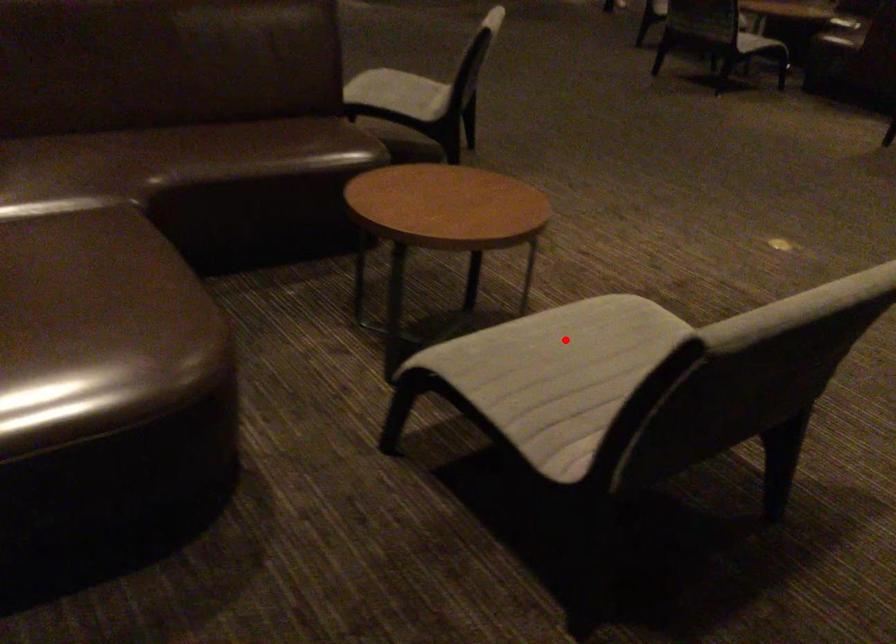
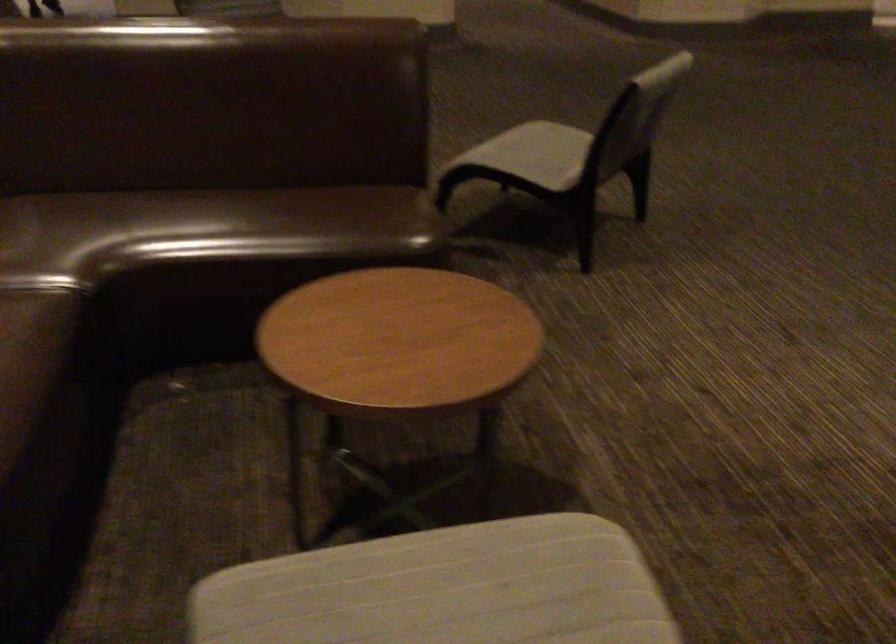
Question: I am providing you with two images of the same scene from different viewpoints. A red point is shown in image1. For the corresponding object point in image2, is it positioned nearer or farther from the camera?

Choices:
 (A) Nearer
 (B) Farther

Answer: (A)